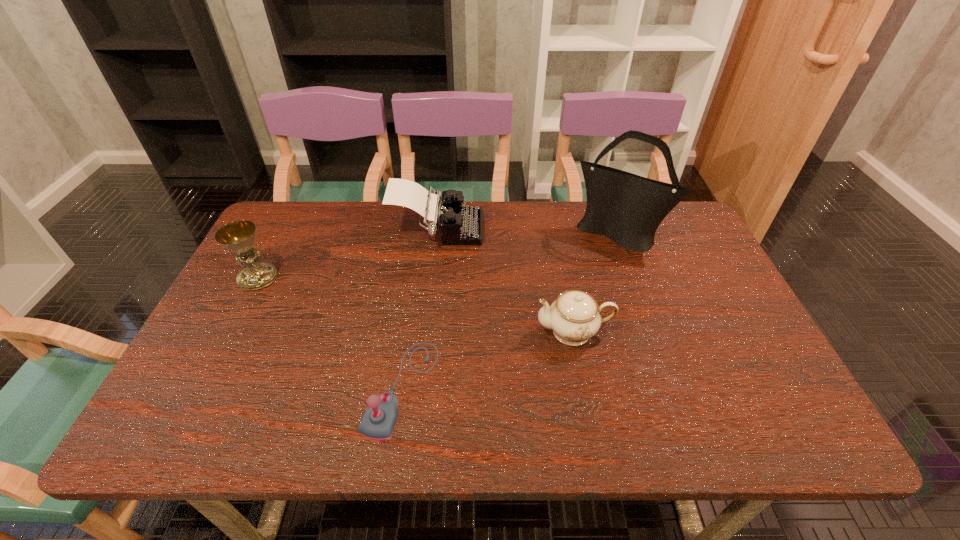
Where is `vacant space located 0.310m at the spout of the chinaware`? The image size is (960, 540). vacant space located 0.310m at the spout of the chinaware is located at coordinates (410, 332).

The height and width of the screenshot is (540, 960). Find the location of `free space located 0.250m at the spout of the chinaware`. free space located 0.250m at the spout of the chinaware is located at coordinates (434, 332).

This screenshot has width=960, height=540. Find the location of `blank area located 0.070m on the right of the shortest object`. blank area located 0.070m on the right of the shortest object is located at coordinates (468, 388).

The width and height of the screenshot is (960, 540). I want to click on shoulder bag present at the far edge, so click(627, 208).

Image resolution: width=960 pixels, height=540 pixels. What are the coordinates of `typewriter situated at the far edge` in the screenshot? It's located at (459, 225).

You are a GUI agent. You are given a task and a screenshot of the screen. Output one action in this format:
    pyautogui.click(x=<x>, y=<y>)
    Task: Click on the object at the near edge
    Image resolution: width=960 pixels, height=540 pixels.
    Given the screenshot: What is the action you would take?
    pyautogui.click(x=379, y=420)

Find the location of a particular element. The image size is (960, 540). object that is at the left edge is located at coordinates (239, 236).

Locate an element on the screen. object that is at the right edge is located at coordinates [x=627, y=208].

In order to click on object present at the far right corner in this screenshot , I will do `click(627, 208)`.

The height and width of the screenshot is (540, 960). In the image, there is a desktop. In order to click on vacant area at the far edge in this screenshot , I will do `click(516, 237)`.